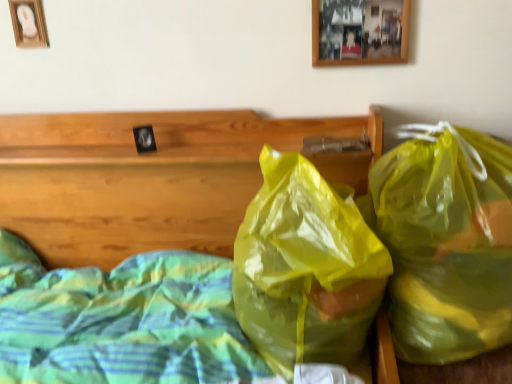
Question: Is translucent yellow plastic bag at center, which is counted as the second plastic bag, starting from the right, situated inside translucent plastic bags at center or outside?

Choices:
 (A) inside
 (B) outside

Answer: (A)

Question: Is point (246, 269) positioned closer to the camera than point (112, 160)?

Choices:
 (A) closer
 (B) farther

Answer: (A)

Question: Which is farther from the translucent yellow plastic bag at center, which is counted as the second plastic bag, starting from the right?

Choices:
 (A) wooden picture frame at upper left, which appears as the 1th picture frame when viewed from the back
 (B) wooden picture frame at upper center, acting as the 2th picture frame starting from the back
 (C) translucent plastic bags at center
 (D) translucent yellow plastic bag at right, which is counted as the 1th plastic bag, starting from the right

Answer: (A)

Question: Based on their relative distances, which object is nearer to the wooden picture frame at upper center, the 1th picture frame positioned from the front?

Choices:
 (A) wooden picture frame at upper left, which appears as the 1th picture frame when viewed from the back
 (B) translucent yellow plastic bag at right, which is counted as the 1th plastic bag, starting from the right
 (C) translucent yellow plastic bag at center, which is counted as the second plastic bag, starting from the right
 (D) translucent plastic bags at center

Answer: (B)